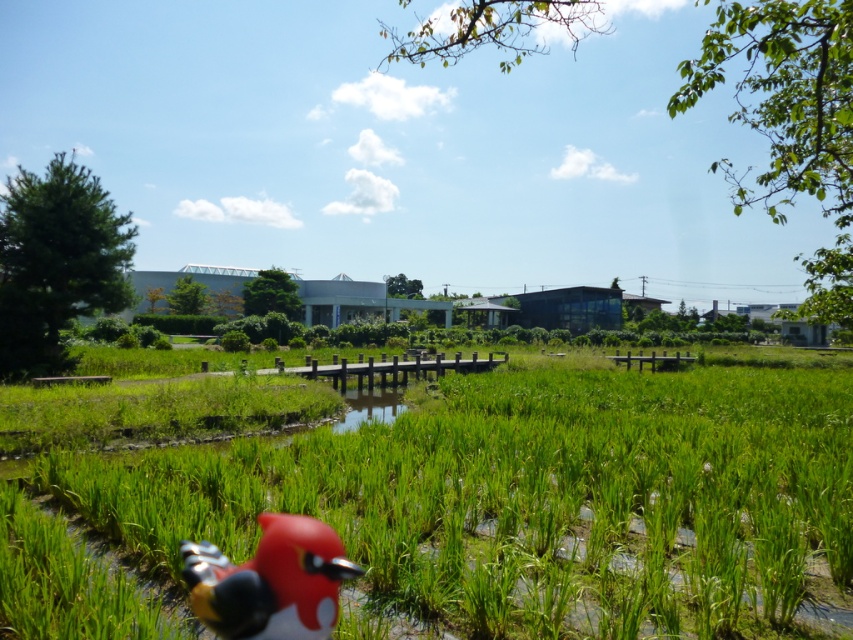
You are a photographer wanting to capture both the green grass at center and the rubberized red bird at lower left in a single frame. Considering their sizes, which object should you focus on first to ensure both are in focus?

The green grass at center has a larger size compared to the rubberized red bird at lower left. To ensure both are in focus, you should focus on the green grass at center first since it is larger and requires more detailed sharpness.

You are standing at the point with coordinates point (320, 605) and want to walk towards the point with coordinates point (577, 554). Based on the scene description, will the point you are walking towards be visible to you as you move forward?

Point (577, 554) is behind point (320, 605), so as you walk towards it from point (320, 605), the point you are moving toward will become visible only after passing point (320, 605). However, since you are already at point (320, 605), the target point might be obscured by objects in between. But according to the description, there are no obstructions mentioned, so theoretically, it should remain visible as you move forward.